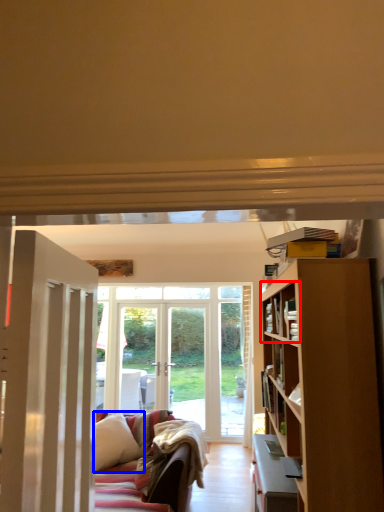
Question: Which point is closer to the camera, shelf (highlighted by a red box) or pillow (highlighted by a blue box)?

Choices:
 (A) shelf
 (B) pillow

Answer: (A)